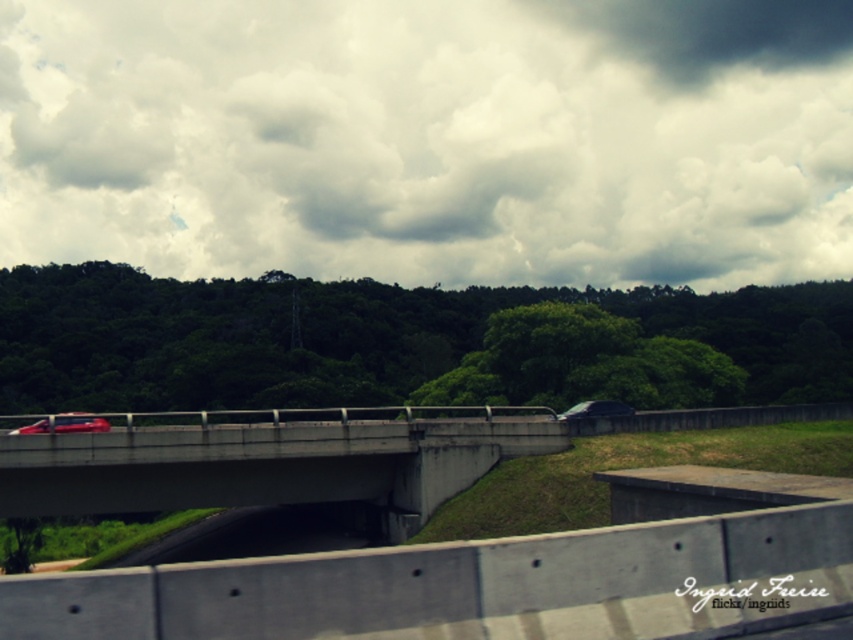
You are a driver planning to parallel park your car behind the shiny red car at center and the smokey gray car at center. Which car should you choose to park behind to have enough space for your compact car?

The shiny red car at center has a lesser width compared to smokey gray car at center, so you should park behind the shiny red car at center as it leaves more space for your compact car.

Consider the image. You are a photographer planning to take a picture of the cloudy sky at upper center and the shiny red car at center. Which object will appear smaller in the photo?

The shiny red car at center will appear smaller in the photo because it is positioned behind the cloudy sky at upper center, making it farther away from the camera and thus appearing smaller due to perspective.

Based on the photo, you are a driver approaching the concrete bridge at center and the smokey gray car at center. Which object is taller?

The concrete bridge at center is taller than the smokey gray car at center.